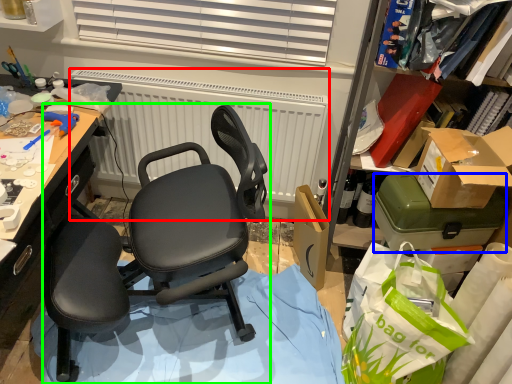
Question: Which is nearer to the radiator (highlighted by a red box)? box (highlighted by a blue box) or chair (highlighted by a green box).

Choices:
 (A) box
 (B) chair

Answer: (B)